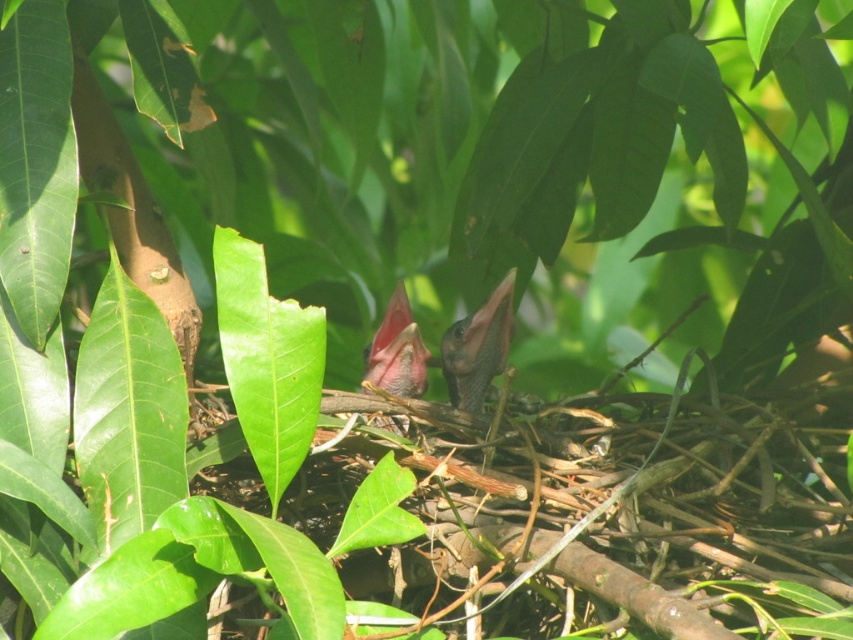
Question: Which of the following is the farthest from the observer?

Choices:
 (A) pink matte beak at center
 (B) smooth black beak at center

Answer: (B)

Question: Which of the following is the farthest from the observer?

Choices:
 (A) (422, 365)
 (B) (450, 352)

Answer: (B)

Question: Is smooth black beak at center thinner than pink matte beak at center?

Choices:
 (A) yes
 (B) no

Answer: (B)

Question: Can you confirm if smooth black beak at center is wider than pink matte beak at center?

Choices:
 (A) no
 (B) yes

Answer: (B)

Question: Can you confirm if smooth black beak at center is positioned above pink matte beak at center?

Choices:
 (A) no
 (B) yes

Answer: (B)